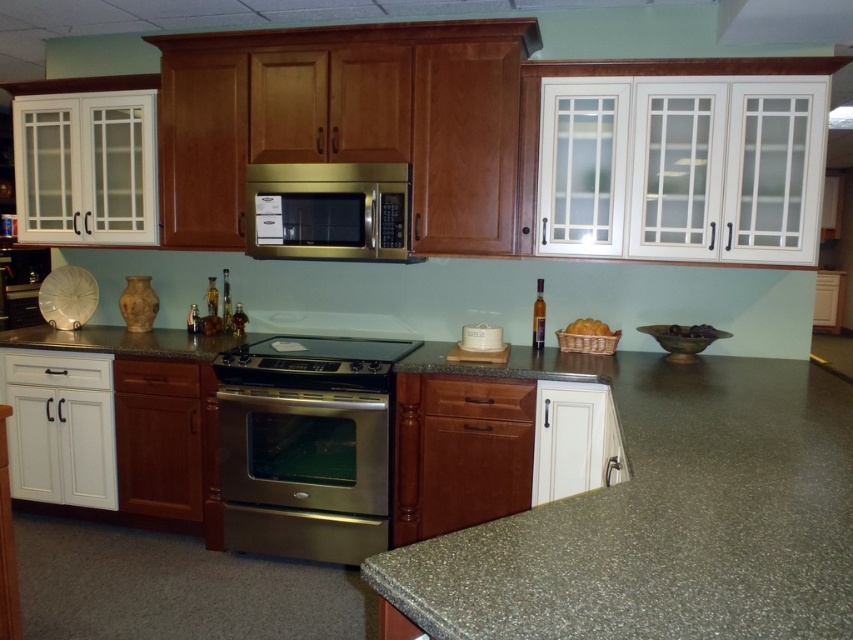
Who is positioned more to the right, stainless steel stove at center or satin stainless steel exhaust hood at upper center?

From the viewer's perspective, satin stainless steel exhaust hood at upper center appears more on the right side.

Is point (300, 340) positioned before point (811, 19)?

No, it is not.

The image size is (853, 640). Identify the location of stainless steel stove at center. 312,362.

Does stainless steel oven at center appear on the right side of satin gold microwave at center?

Incorrect, stainless steel oven at center is not on the right side of satin gold microwave at center.

Which is in front, point (299, 419) or point (370, 164)?

Point (299, 419)

Identify the location of stainless steel oven at center. (303, 472).

At what (x,y) coordinates should I click in order to perform the action: click on stainless steel oven at center. Please return your answer as a coordinate pair (x, y). Image resolution: width=853 pixels, height=640 pixels. Looking at the image, I should click on (303, 472).

Measure the distance between point (474, 378) and camera.

Point (474, 378) is 2.86 meters away from camera.

Is granite countertop at center thinner than stainless steel stove at center?

No.

Who is more forward, (711, 474) or (231, 349)?

Positioned in front is point (711, 474).

Where is `granite countertop at center`? The image size is (853, 640). granite countertop at center is located at coordinates (631, 516).